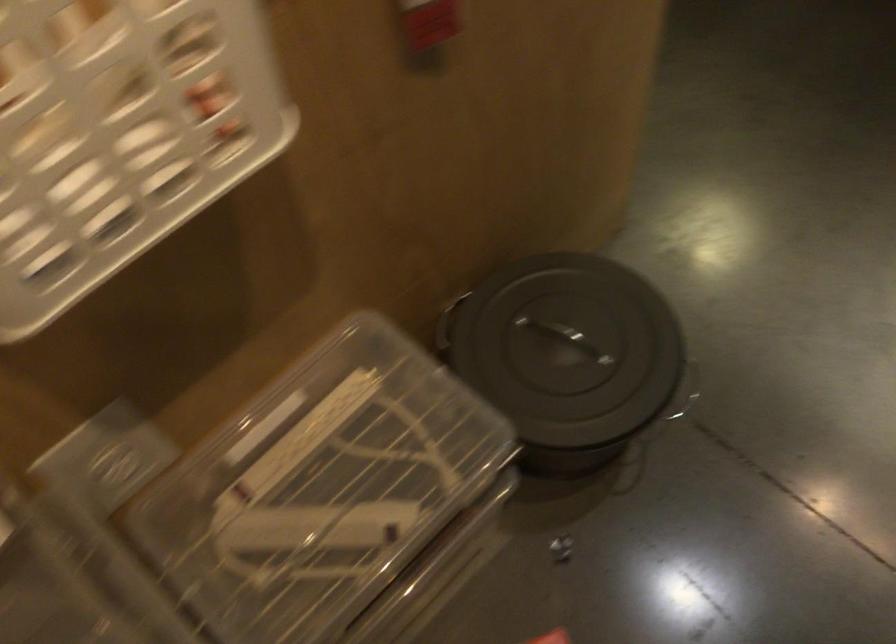
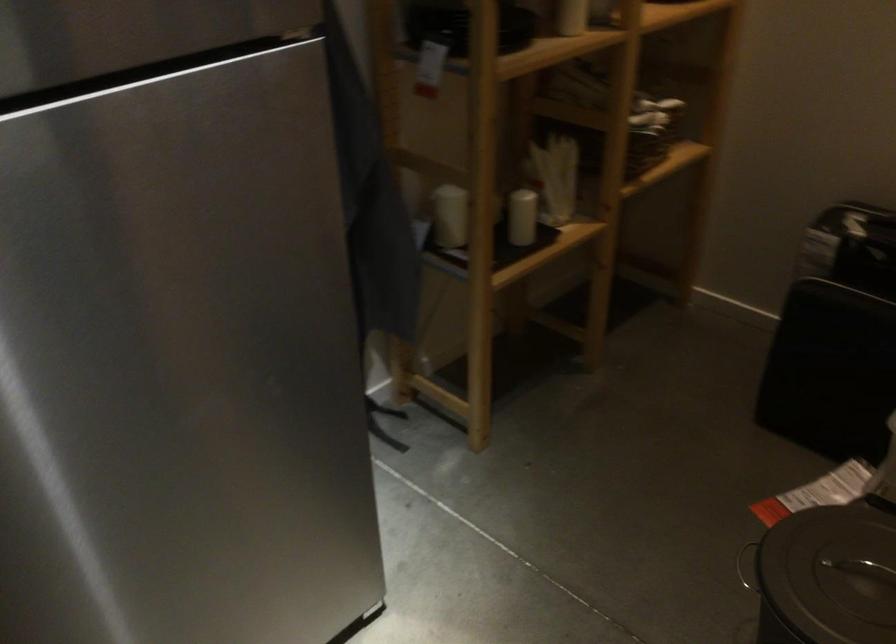
In the second image, find the point that corresponds to point (442, 231) in the first image.

(828, 576)